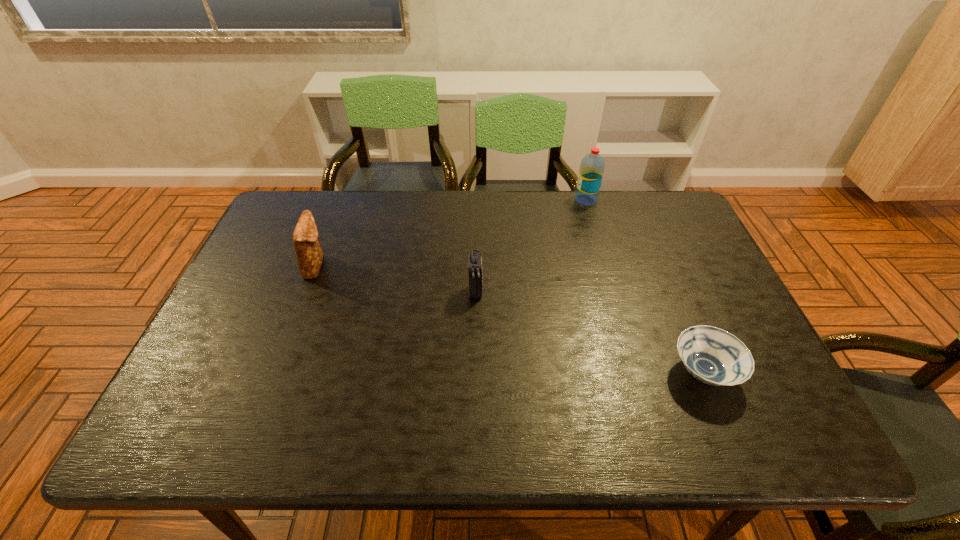
Image resolution: width=960 pixels, height=540 pixels. I want to click on the tallest object, so click(592, 166).

You are a GUI agent. You are given a task and a screenshot of the screen. Output one action in this format:
    pyautogui.click(x=<x>, y=<y>)
    Task: Click on the water bottle
    
    Given the screenshot: What is the action you would take?
    pyautogui.click(x=592, y=166)

I want to click on the leftmost object, so click(x=309, y=255).

The width and height of the screenshot is (960, 540). What are the coordinates of `the shorter clutch bag` in the screenshot? It's located at (475, 274).

Find the location of a particular element. The image size is (960, 540). the second shortest object is located at coordinates (475, 274).

Find the location of a particular element. This screenshot has width=960, height=540. the nearest object is located at coordinates (714, 356).

At what (x,y) coordinates should I click in order to perform the action: click on soup bowl. Please return your answer as a coordinate pair (x, y). The image size is (960, 540). Looking at the image, I should click on (714, 356).

Image resolution: width=960 pixels, height=540 pixels. Find the location of `vacant space located 0.070m on the front label of the farthest object`. vacant space located 0.070m on the front label of the farthest object is located at coordinates (554, 200).

The height and width of the screenshot is (540, 960). Find the location of `free space located on the front label of the farthest object`. free space located on the front label of the farthest object is located at coordinates (557, 200).

The image size is (960, 540). In order to click on free space located 0.280m on the front label of the farthest object in this screenshot , I will do `click(492, 200)`.